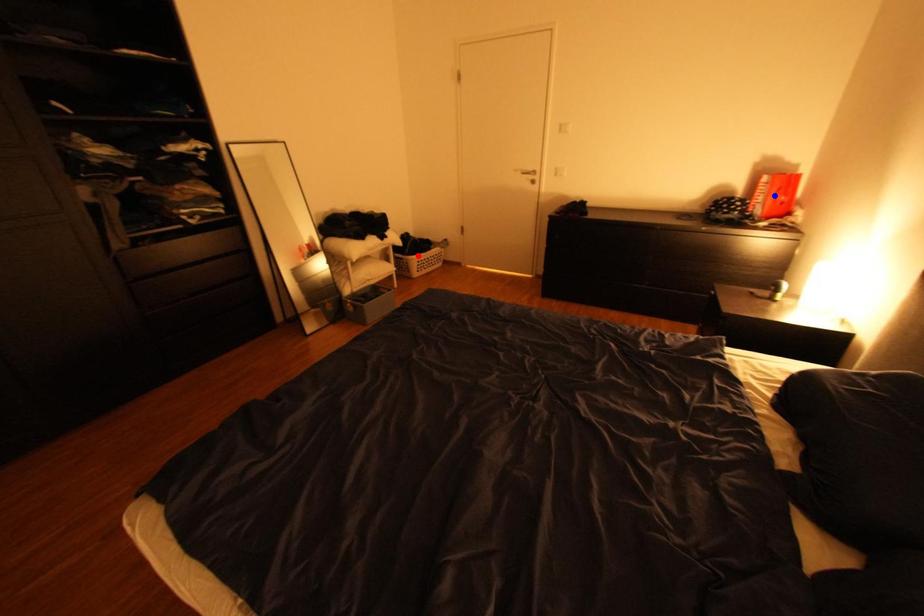
Question: Which of the two points in the image is closer to the camera?

Choices:
 (A) Blue point is closer.
 (B) Red point is closer.

Answer: (A)